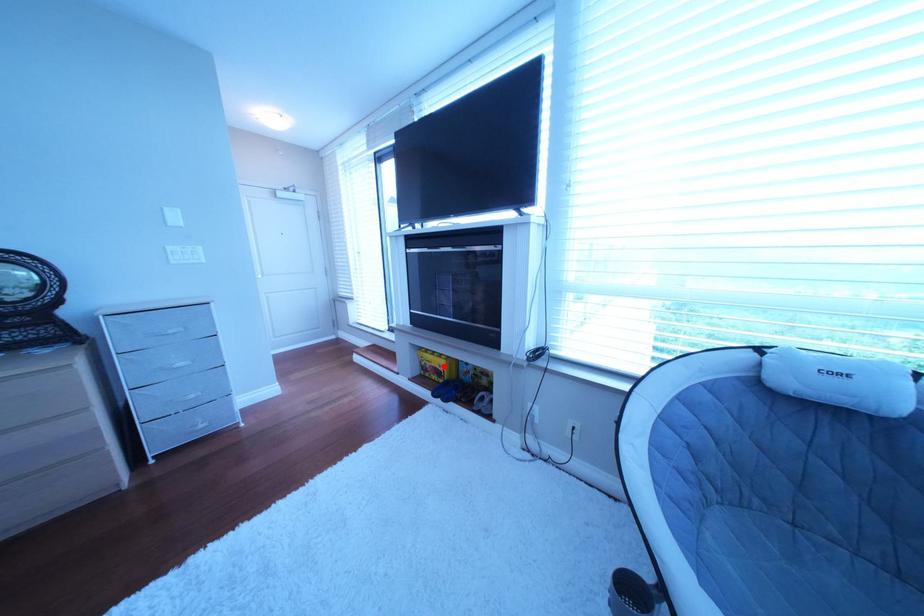
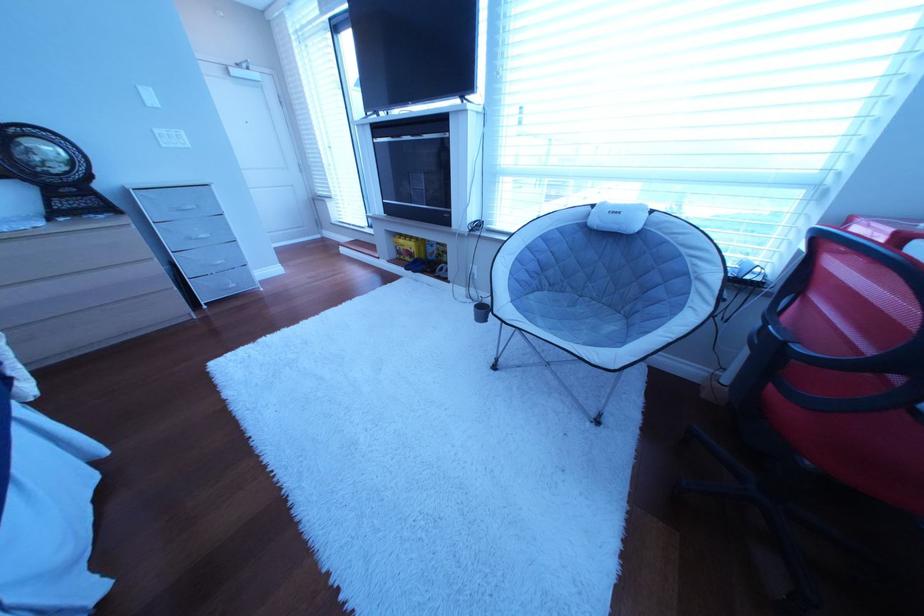
Question: I am providing you with two images of the same scene from different viewpoints. In image1, a red point is highlighted. Considering the same 3D point in image2, which of the following is correct?

Choices:
 (A) It is closer
 (B) It is farther

Answer: (A)